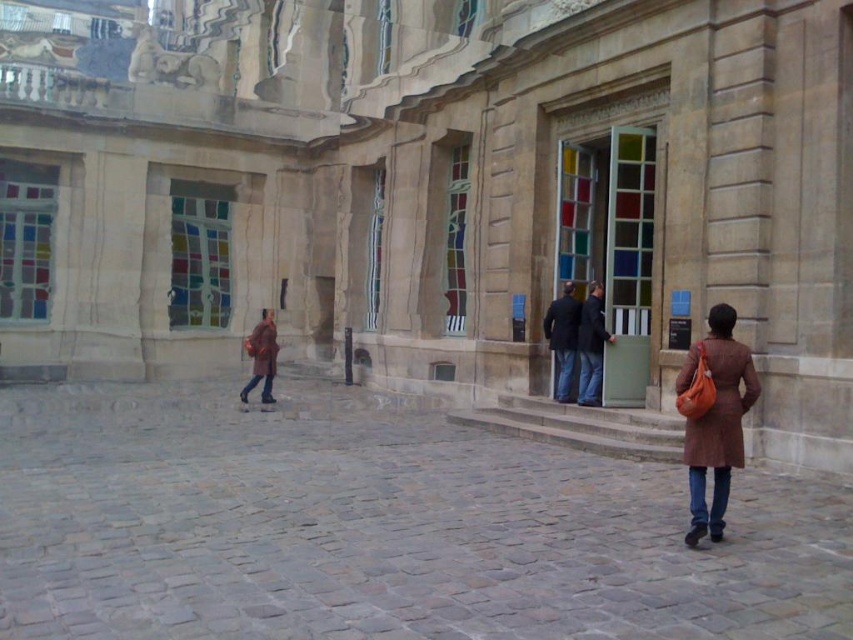
Question: Estimate the real-world distances between objects in this image. Which object is farther from the brown leather coat at lower left?

Choices:
 (A) gray cobblestone pavement at center
 (B) dark brown coat at center
 (C) brown leather coat at center

Answer: (C)

Question: Estimate the real-world distances between objects in this image. Which object is farther from the brown leather coat at center?

Choices:
 (A) gray cobblestone pavement at center
 (B) brown leather coat at lower left

Answer: (B)

Question: Can you confirm if brown leather coat at lower left is wider than brown matte coat at center?

Choices:
 (A) yes
 (B) no

Answer: (A)

Question: Which of the following is the farthest from the observer?

Choices:
 (A) (271, 332)
 (B) (563, 324)
 (C) (590, 333)

Answer: (A)

Question: Can you confirm if gray cobblestone pavement at center is positioned above brown leather coat at lower left?

Choices:
 (A) no
 (B) yes

Answer: (A)

Question: Is brown leather coat at lower left to the right of brown leather coat at center from the viewer's perspective?

Choices:
 (A) yes
 (B) no

Answer: (B)